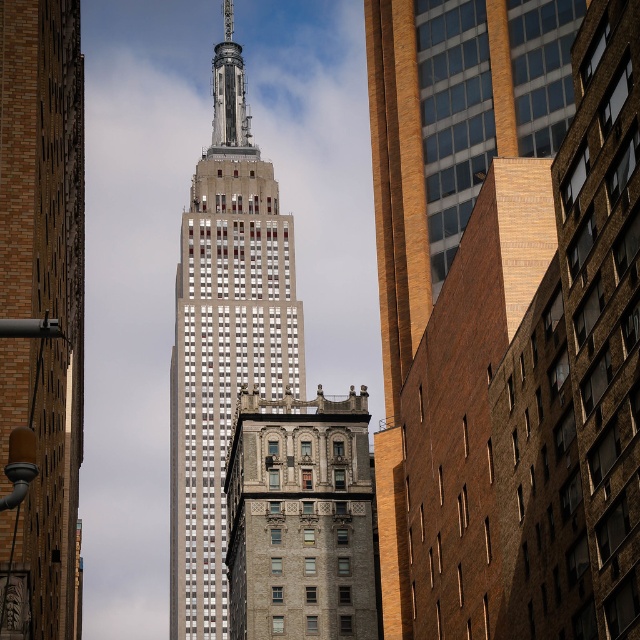
You are standing in the city and see the white marble tower at center and the gray stone building at center. Which one appears closer to you?

The white marble tower at center appears closer to you because it is further to the viewer than the gray stone building at center.

You are standing in a park across from the Empire State Building and notice two buildings in the scene. According to the image, which one is positioned to the left of the other between the white glass skyscraper at center and the gray stone building at center?

The white glass skyscraper at center is positioned to the left of the gray stone building at center.

You are an architect analyzing the skyline of New York City. You observe the white glass skyscraper at center and the gray stone building at center. Which one has a greater height?

The white glass skyscraper at center is taller than the gray stone building at center.